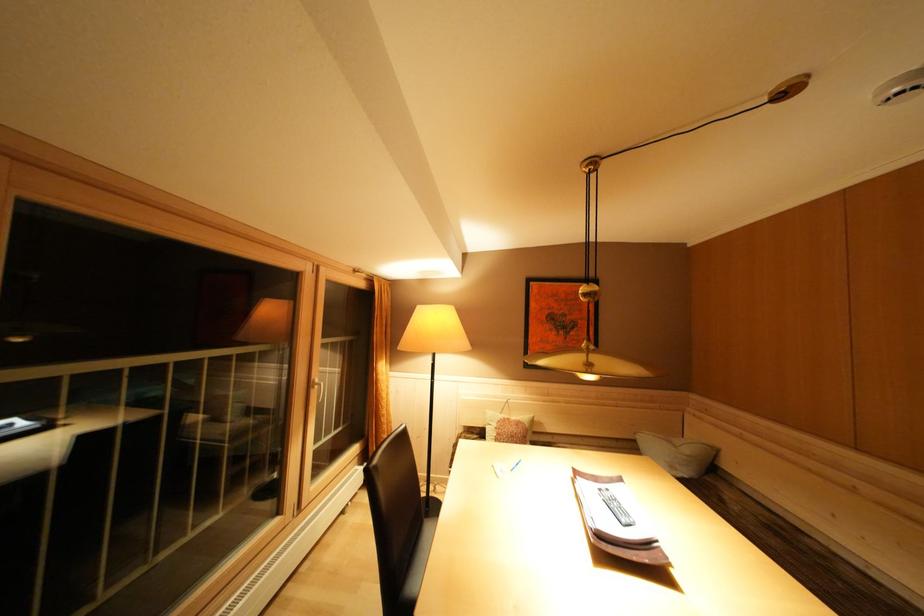
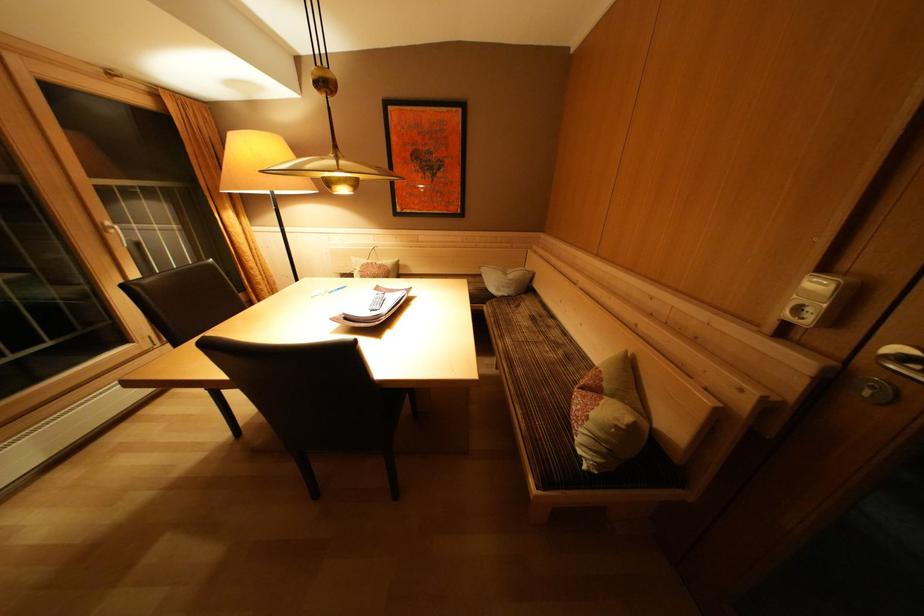
Locate, in the second image, the point that corresponds to the point at 695,456 in the first image.

(517, 281)